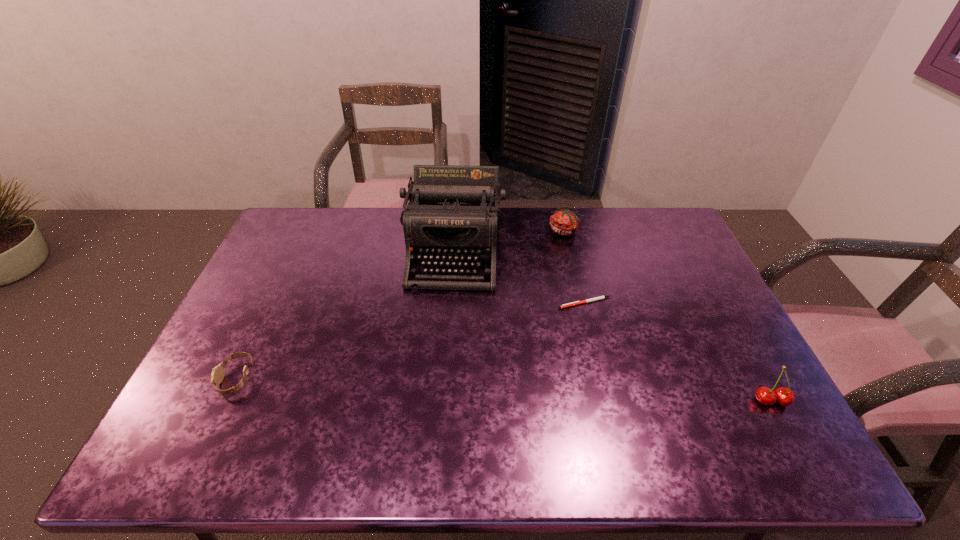
Locate an element on the screen. blank space located on the front-facing side of the tomato is located at coordinates (562, 252).

Find the location of a particular element. The image size is (960, 540). vacant space located on the front-facing side of the tomato is located at coordinates (562, 252).

Locate an element on the screen. This screenshot has height=540, width=960. vacant space situated on the clicker of the shortest object is located at coordinates (532, 343).

Image resolution: width=960 pixels, height=540 pixels. What are the coordinates of `free spot located on the clicker of the shortest object` in the screenshot? It's located at (525, 349).

At what (x,y) coordinates should I click in order to perform the action: click on free space located on the clicker of the shortest object. Please return your answer as a coordinate pair (x, y). Looking at the image, I should click on (550, 325).

Locate an element on the screen. The height and width of the screenshot is (540, 960). vacant space located 0.290m on the keyboard of the second object from left to right is located at coordinates (440, 372).

Identify the location of free space located on the keyboard of the second object from left to right. The image size is (960, 540). (444, 344).

At what (x,y) coordinates should I click in order to perform the action: click on vacant space located on the keyboard of the second object from left to right. Please return your answer as a coordinate pair (x, y). The image size is (960, 540). Looking at the image, I should click on (438, 391).

The image size is (960, 540). I want to click on tomato that is at the far edge, so click(x=563, y=222).

The width and height of the screenshot is (960, 540). I want to click on typewriter that is at the far edge, so (452, 218).